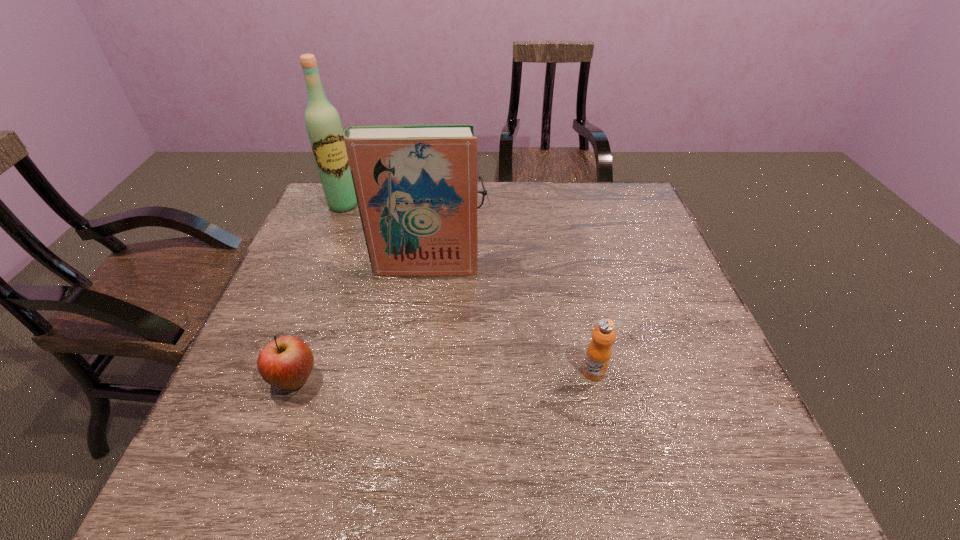
Identify the location of free spot on the desktop that is between the apple and the orange juice and is positioned on the cover of the hardback book. (414, 377).

Identify the location of vacant spot on the desktop that is between the fourth tallest object and the rightmost object and is positioned on the front-facing side of the shortest object. (490, 375).

Where is `free spot on the desktop that is between the apple and the rightmost object and is positioned on the front-facing side of the wine bottle`? The image size is (960, 540). free spot on the desktop that is between the apple and the rightmost object and is positioned on the front-facing side of the wine bottle is located at coordinates (469, 375).